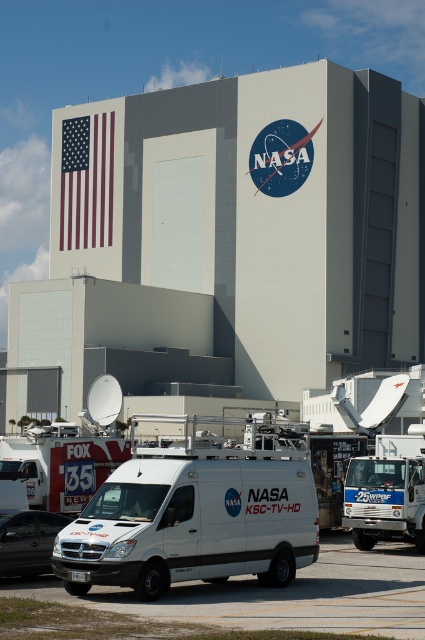
Does white metallic ambulance at center have a greater width compared to red-white-and-blue fabric flag at upper left?

No.

Is point (362, 474) more distant than point (76, 240)?

No, it is in front of (76, 240).

Is point (411, 508) farther from camera compared to point (76, 172)?

No, (411, 508) is in front of (76, 172).

Where is `white metallic ambulance at center`? white metallic ambulance at center is located at coordinates (387, 492).

Can you confirm if white smooth tarmac at lower center is smaller than white metallic ambulance at center?

Incorrect, white smooth tarmac at lower center is not smaller in size than white metallic ambulance at center.

Does point (124, 612) come closer to viewer compared to point (391, 484)?

Yes, it is.

Identify the location of white smooth tarmac at lower center. (280, 595).

Which of these two, white smooth tarmac at lower center or black matte van at lower left, stands shorter?

Standing shorter between the two is black matte van at lower left.

Is the position of white smooth tarmac at lower center less distant than that of black matte van at lower left?

Yes, it is in front of black matte van at lower left.

Which is behind, point (311, 625) or point (61, 516)?

The point (61, 516) is more distant.

At what (x,y) coordinates should I click in order to perform the action: click on white smooth tarmac at lower center. Please return your answer as a coordinate pair (x, y). Looking at the image, I should click on (280, 595).